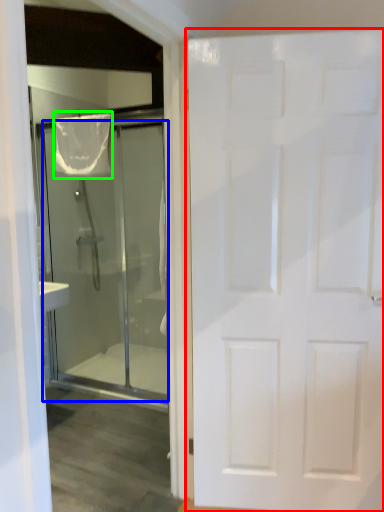
Question: Which object is the closest to the door (highlighted by a red box)? Choose among these: door (highlighted by a blue box) or shower curtain (highlighted by a green box).

Choices:
 (A) door
 (B) shower curtain

Answer: (B)